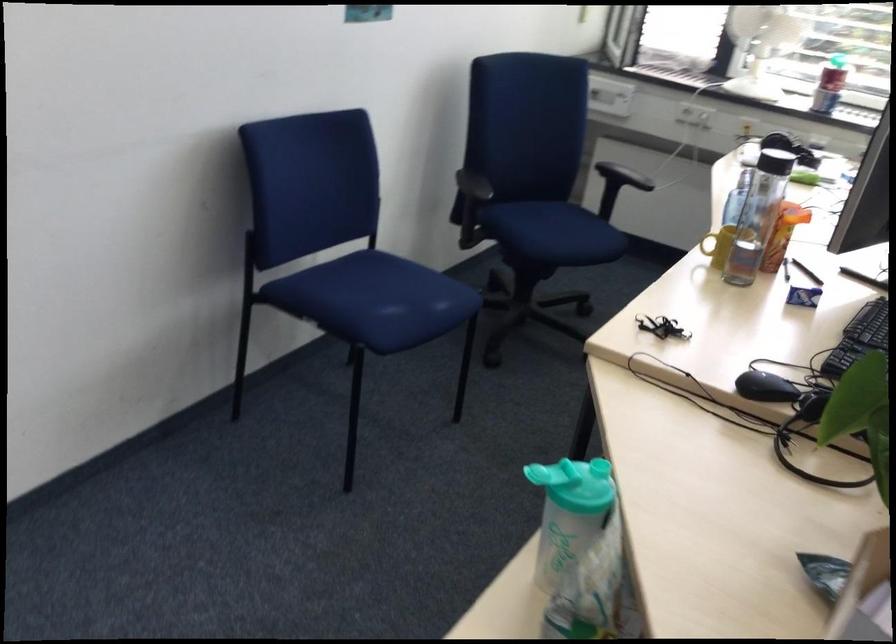
The location [661,327] corresponds to which object?

It corresponds to the yellow mug in the image.